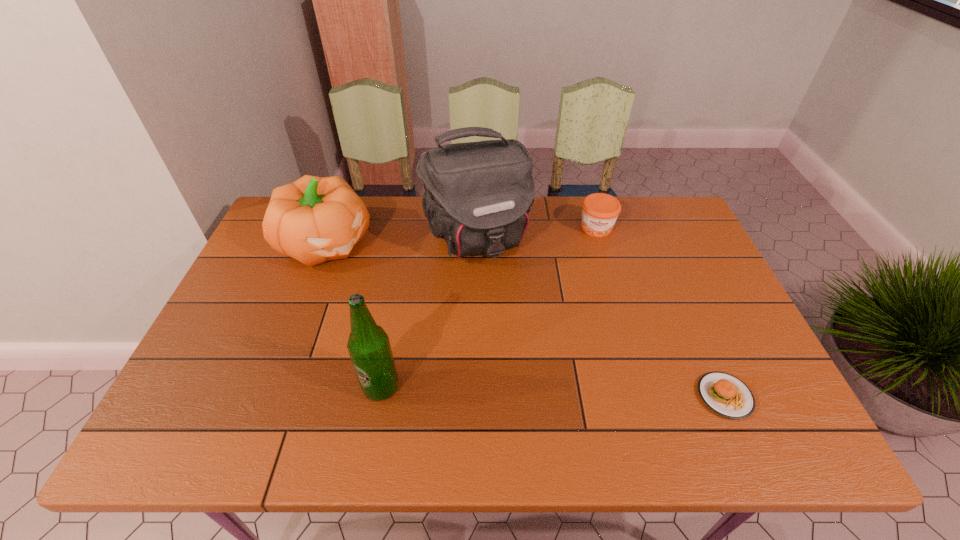
I want to click on vacant space at the near edge, so pyautogui.click(x=462, y=399).

In the image, there is a desktop. What are the coordinates of `blank space at the right edge` in the screenshot? It's located at (679, 293).

Identify the location of free space at the near left corner of the desktop. (195, 387).

The image size is (960, 540). I want to click on empty location between the second shortest object and the second object from left to right, so click(x=489, y=308).

The image size is (960, 540). Find the location of `free point between the tallest object and the third shortest object`. free point between the tallest object and the third shortest object is located at coordinates (401, 241).

This screenshot has width=960, height=540. What are the coordinates of `vacant region between the third tallest object and the food` in the screenshot? It's located at (525, 320).

You are a GUI agent. You are given a task and a screenshot of the screen. Output one action in this format:
    pyautogui.click(x=<x>, y=<y>)
    Task: Click on the free space between the food and the tallest object
    
    Given the screenshot: What is the action you would take?
    pyautogui.click(x=601, y=318)

This screenshot has width=960, height=540. What are the coordinates of `vacant area that lies between the fourth shortest object and the fourth tallest object` in the screenshot? It's located at (489, 308).

The image size is (960, 540). Identify the location of free space between the tallest object and the second object from left to right. (429, 313).

Locate an element on the screen. The height and width of the screenshot is (540, 960). vacant space that is in between the shoulder bag and the fourth object from right to left is located at coordinates (429, 313).